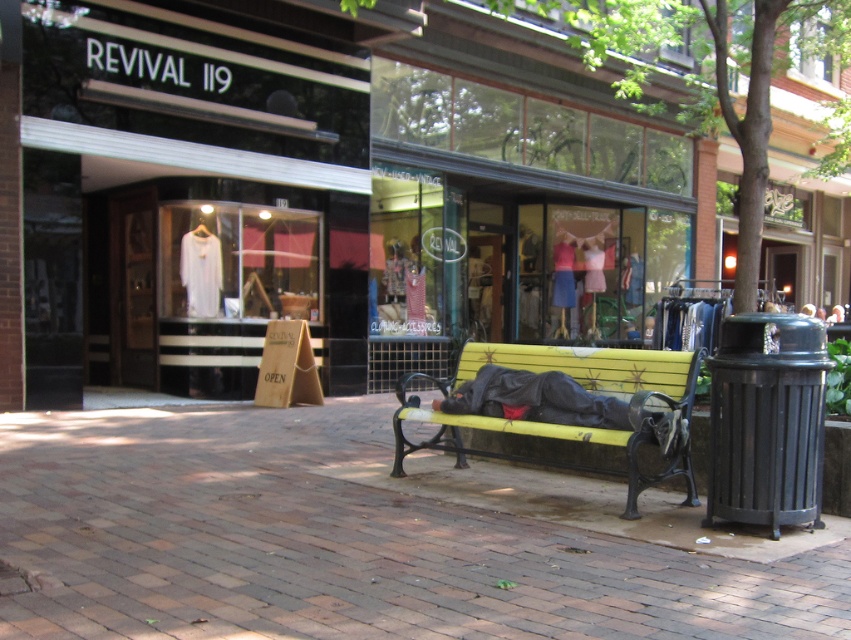
Question: Considering the relative positions of brick pavement at center and yellow painted wood bench at center in the image provided, where is brick pavement at center located with respect to yellow painted wood bench at center?

Choices:
 (A) right
 (B) left

Answer: (B)

Question: Which object appears farthest from the camera in this image?

Choices:
 (A) brick pavement at center
 (B) yellow painted wood bench at center

Answer: (B)

Question: Which point is closer to the camera?

Choices:
 (A) yellow painted wood bench at center
 (B) brick pavement at center

Answer: (B)

Question: Which object is closer to the camera taking this photo?

Choices:
 (A) brick pavement at center
 (B) yellow painted wood bench at center

Answer: (A)

Question: Is brick pavement at center bigger than yellow painted wood bench at center?

Choices:
 (A) no
 (B) yes

Answer: (A)

Question: Does brick pavement at center have a greater width compared to yellow painted wood bench at center?

Choices:
 (A) no
 (B) yes

Answer: (A)